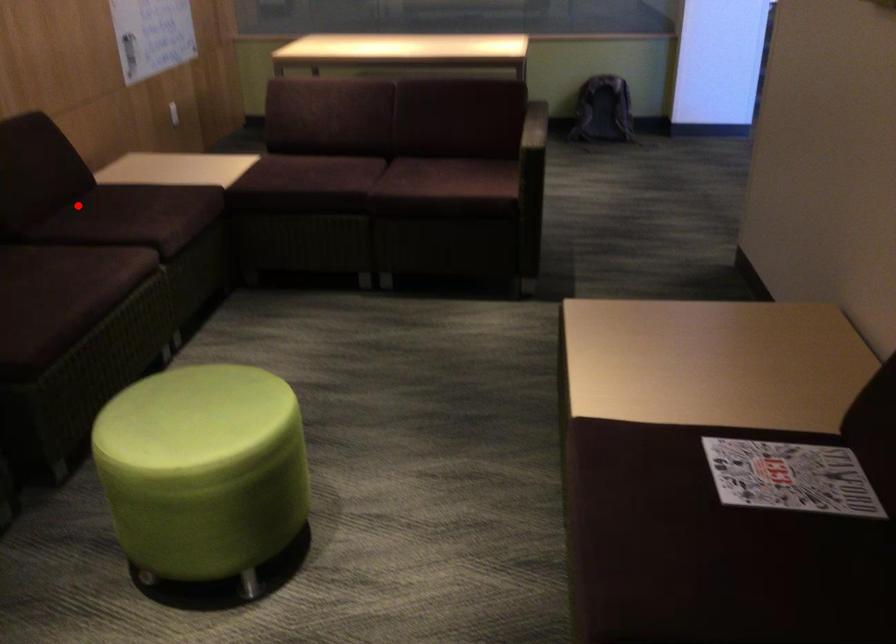
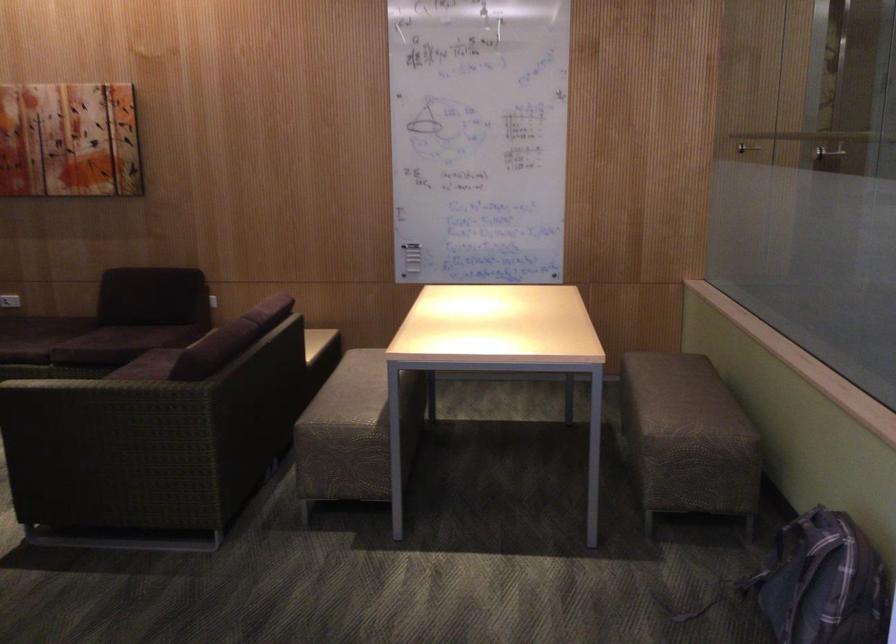
Where in the second image is the point corresponding to the highlighted location from the first image?

(123, 322)